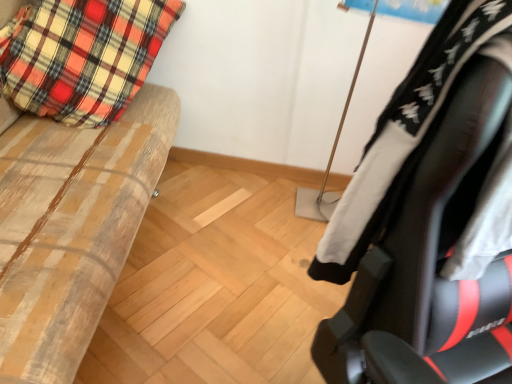
Question: Is black leather chair at right directly adjacent to wooden bench at left?

Choices:
 (A) no
 (B) yes

Answer: (A)

Question: Is black leather chair at right completely or partially outside of wooden bench at left?

Choices:
 (A) no
 (B) yes

Answer: (B)

Question: Can you confirm if black leather chair at right is taller than wooden bench at left?

Choices:
 (A) no
 (B) yes

Answer: (A)

Question: Can you confirm if black leather chair at right is smaller than wooden bench at left?

Choices:
 (A) no
 (B) yes

Answer: (B)

Question: Does black leather chair at right have a lesser height compared to wooden bench at left?

Choices:
 (A) yes
 (B) no

Answer: (A)

Question: From a real-world perspective, is black leather chair at right over wooden bench at left?

Choices:
 (A) no
 (B) yes

Answer: (B)

Question: Is wooden bench at left shorter than plaid fabric pillow at left?

Choices:
 (A) yes
 (B) no

Answer: (B)

Question: Is wooden bench at left at the right side of plaid fabric pillow at left?

Choices:
 (A) no
 (B) yes

Answer: (A)

Question: From a real-world perspective, is wooden bench at left on plaid fabric pillow at left?

Choices:
 (A) no
 (B) yes

Answer: (A)

Question: Is wooden bench at left far from plaid fabric pillow at left?

Choices:
 (A) no
 (B) yes

Answer: (A)

Question: Can you see wooden bench at left touching plaid fabric pillow at left?

Choices:
 (A) yes
 (B) no

Answer: (B)

Question: Is wooden bench at left smaller than plaid fabric pillow at left?

Choices:
 (A) no
 (B) yes

Answer: (A)

Question: From a real-world perspective, is plaid fabric pillow at left physically above black leather chair at right?

Choices:
 (A) no
 (B) yes

Answer: (A)